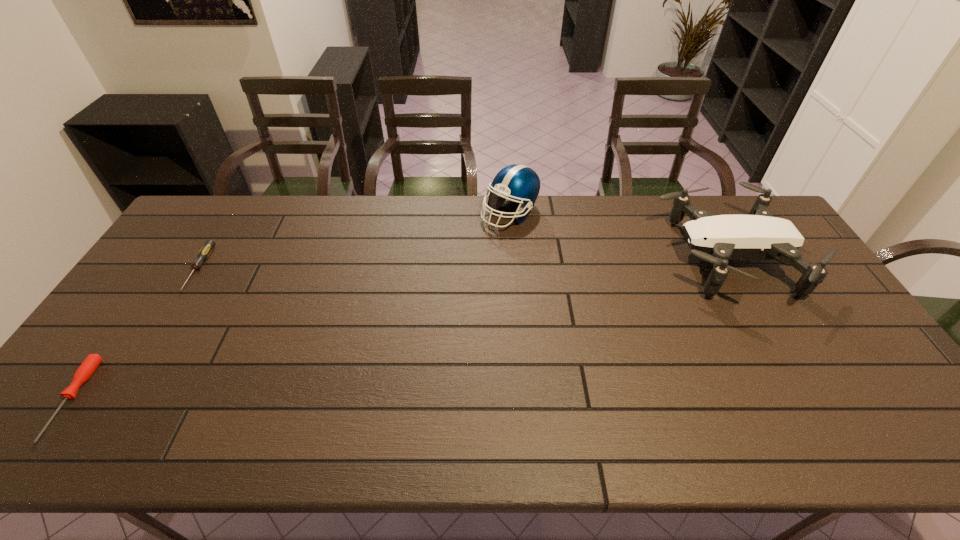
The image size is (960, 540). I want to click on vacant region at the left edge of the desktop, so click(194, 281).

Locate an element on the screen. The width and height of the screenshot is (960, 540). vacant space at the right edge of the desktop is located at coordinates (756, 261).

Find the location of a particular element. vacant space at the far left corner is located at coordinates (226, 196).

Locate an element on the screen. free spot between the farther screwdriver and the third object from left to right is located at coordinates (354, 241).

At what (x,y) coordinates should I click in order to perform the action: click on free area in between the leftmost object and the football helmet. Please return your answer as a coordinate pair (x, y). Looking at the image, I should click on (291, 306).

You are a GUI agent. You are given a task and a screenshot of the screen. Output one action in this format:
    pyautogui.click(x=<x>, y=<y>)
    Task: Click on the free space that is in between the nearest object and the third object from left to right
    
    Given the screenshot: What is the action you would take?
    pyautogui.click(x=291, y=306)

Locate an element on the screen. This screenshot has width=960, height=540. free area in between the leftmost object and the football helmet is located at coordinates (291, 306).

You are a GUI agent. You are given a task and a screenshot of the screen. Output one action in this format:
    pyautogui.click(x=<x>, y=<y>)
    Task: Click on the empty location between the farther screwdriver and the left screwdriver
    
    Given the screenshot: What is the action you would take?
    pyautogui.click(x=135, y=334)

This screenshot has height=540, width=960. Find the location of `vacant area between the nearer screwdriver and the rightmost object`. vacant area between the nearer screwdriver and the rightmost object is located at coordinates (399, 328).

This screenshot has width=960, height=540. What are the coordinates of `free space between the third object from left to right and the third shortest object` in the screenshot? It's located at (618, 235).